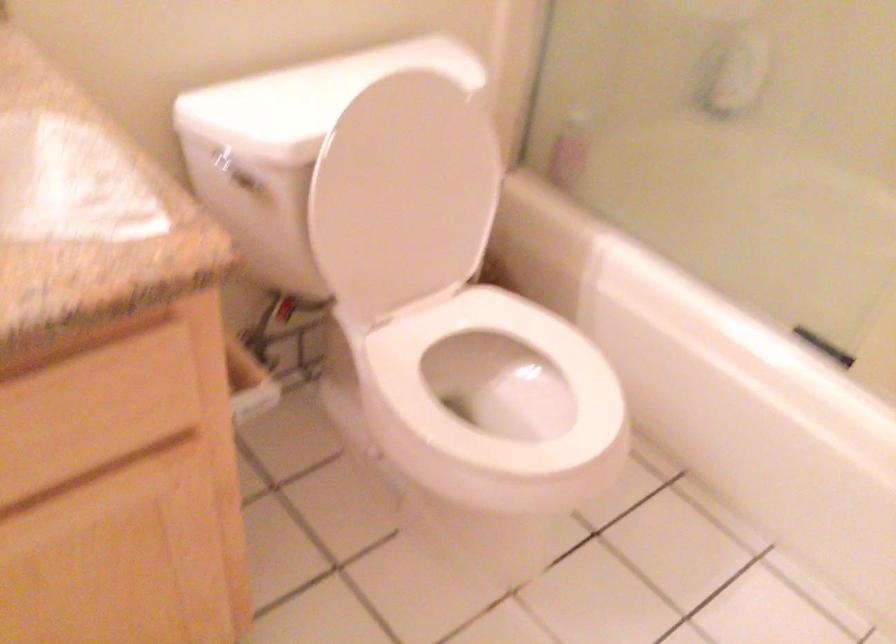
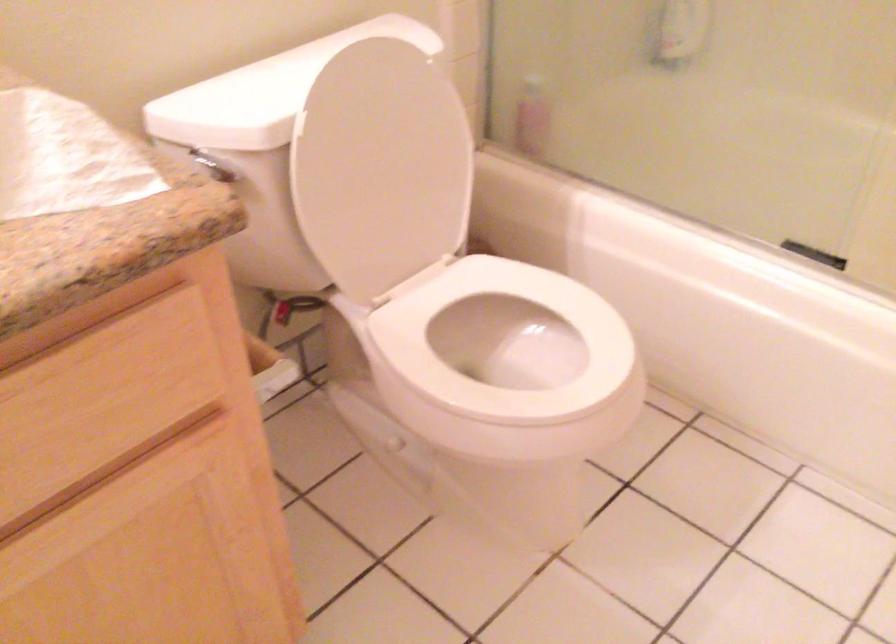
Question: Based on the continuous images, in which direction is the camera rotating? Reply with the corresponding letter.

Choices:
 (A) Left
 (B) Right
 (C) Up
 (D) Down

Answer: (C)